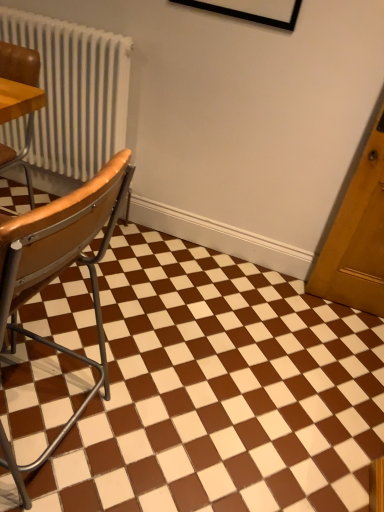
Question: Is wooden seat at left, marked as the 2th chair in a top-to-bottom arrangement, located outside brown glossy tile at center?

Choices:
 (A) yes
 (B) no

Answer: (A)

Question: From the image's perspective, does wooden seat at left, positioned as the 1th chair in bottom-to-top order, appear lower than brown glossy tile at center?

Choices:
 (A) no
 (B) yes

Answer: (A)

Question: Is wooden seat at left, marked as the 2th chair in a top-to-bottom arrangement, not close to brown glossy tile at center?

Choices:
 (A) yes
 (B) no

Answer: (B)

Question: Is wooden seat at left, marked as the 2th chair in a top-to-bottom arrangement, at the left side of brown glossy tile at center?

Choices:
 (A) yes
 (B) no

Answer: (A)

Question: Is wooden seat at left, positioned as the 1th chair in bottom-to-top order, to the right of brown glossy tile at center from the viewer's perspective?

Choices:
 (A) yes
 (B) no

Answer: (B)

Question: Is wooden seat at left, positioned as the 1th chair in bottom-to-top order, facing towards brown glossy tile at center?

Choices:
 (A) yes
 (B) no

Answer: (B)

Question: Does leather seat at left, which appears as the 2th chair when ordered from the bottom, appear on the right side of wooden seat at left, marked as the 2th chair in a top-to-bottom arrangement?

Choices:
 (A) yes
 (B) no

Answer: (B)

Question: Is leather seat at left, which is the first chair in top-to-bottom order, wider than wooden seat at left, marked as the 2th chair in a top-to-bottom arrangement?

Choices:
 (A) no
 (B) yes

Answer: (A)

Question: Is leather seat at left, which is the first chair in top-to-bottom order, at the left side of wooden seat at left, positioned as the 1th chair in bottom-to-top order?

Choices:
 (A) no
 (B) yes

Answer: (B)

Question: Considering the relative sizes of leather seat at left, which is the first chair in top-to-bottom order, and wooden seat at left, positioned as the 1th chair in bottom-to-top order, in the image provided, is leather seat at left, which is the first chair in top-to-bottom order, bigger than wooden seat at left, positioned as the 1th chair in bottom-to-top order,?

Choices:
 (A) yes
 (B) no

Answer: (B)

Question: Is leather seat at left, which appears as the 2th chair when ordered from the bottom, not inside wooden seat at left, marked as the 2th chair in a top-to-bottom arrangement?

Choices:
 (A) yes
 (B) no

Answer: (A)

Question: From a real-world perspective, is leather seat at left, which is the first chair in top-to-bottom order, positioned under wooden seat at left, marked as the 2th chair in a top-to-bottom arrangement, based on gravity?

Choices:
 (A) no
 (B) yes

Answer: (A)

Question: Does leather seat at left, which is the first chair in top-to-bottom order, have a greater height compared to brown glossy tile at center?

Choices:
 (A) no
 (B) yes

Answer: (B)